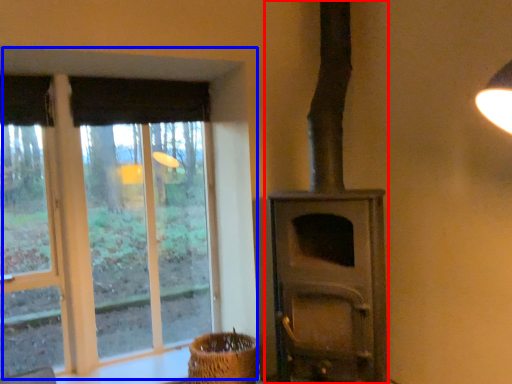
Question: Which point is closer to the camera, wood burning stove (highlighted by a red box) or window (highlighted by a blue box)?

Choices:
 (A) wood burning stove
 (B) window

Answer: (A)